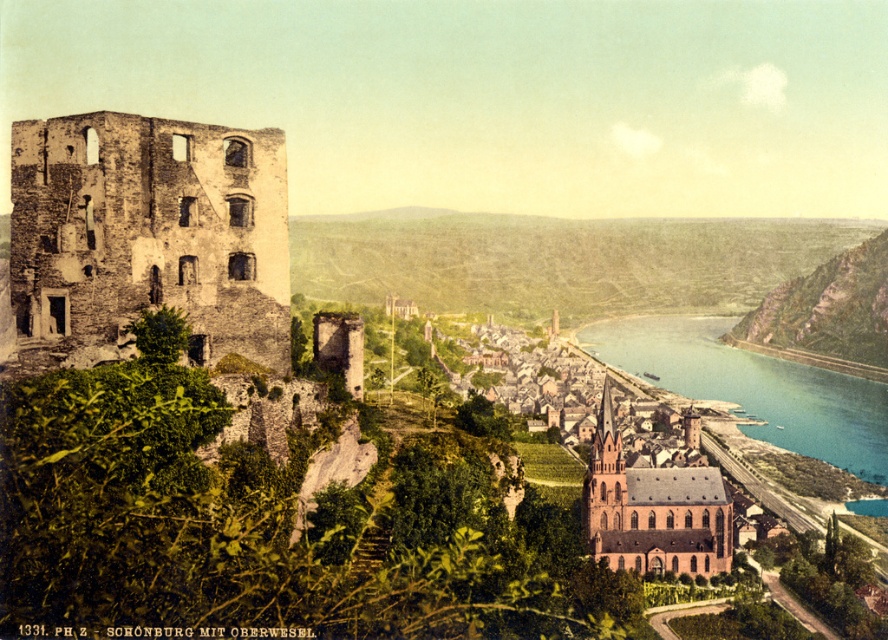
Based on the coordinates provided, what is located at point (754, 387) in the image?

The point (754, 387) indicates blue water at river right.

In the scene shown: You are an architect planning to build a new bridge connecting the ruined castle on the left to the town on the right. Based on the image, which object is located higher in elevation between the blue water at river right and the brown stone church at center?

The blue water at river right is positioned over the brown stone church at center, meaning it is higher in elevation.